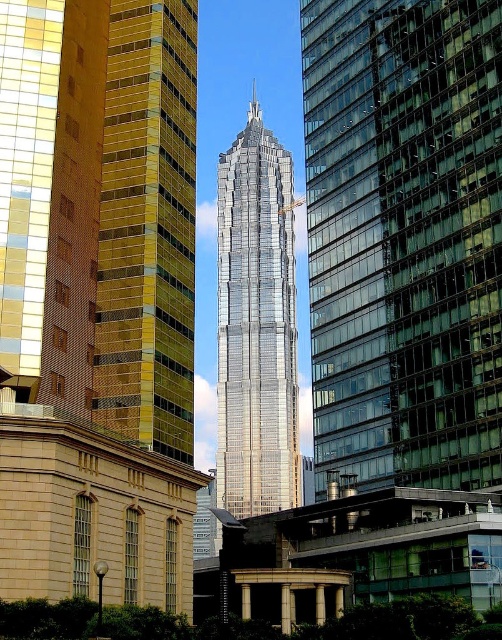
Question: Which point appears closest to the camera in this image?

Choices:
 (A) (x=146, y=180)
 (B) (x=278, y=316)

Answer: (A)

Question: Can you confirm if shiny glass skyscraper at center is positioned below shiny silver skyscraper at center?

Choices:
 (A) yes
 (B) no

Answer: (A)

Question: Does shiny glass skyscraper at center appear on the right side of gold reflective glass tower at left?

Choices:
 (A) yes
 (B) no

Answer: (A)

Question: Does gold reflective glass tower at left come in front of shiny silver skyscraper at center?

Choices:
 (A) no
 (B) yes

Answer: (B)

Question: Which of the following is the farthest from the observer?

Choices:
 (A) 427,192
 (B) 247,227
 (C) 155,419

Answer: (B)

Question: Which point is farther to the camera?

Choices:
 (A) (294, 296)
 (B) (357, 476)
 (C) (119, 45)

Answer: (A)